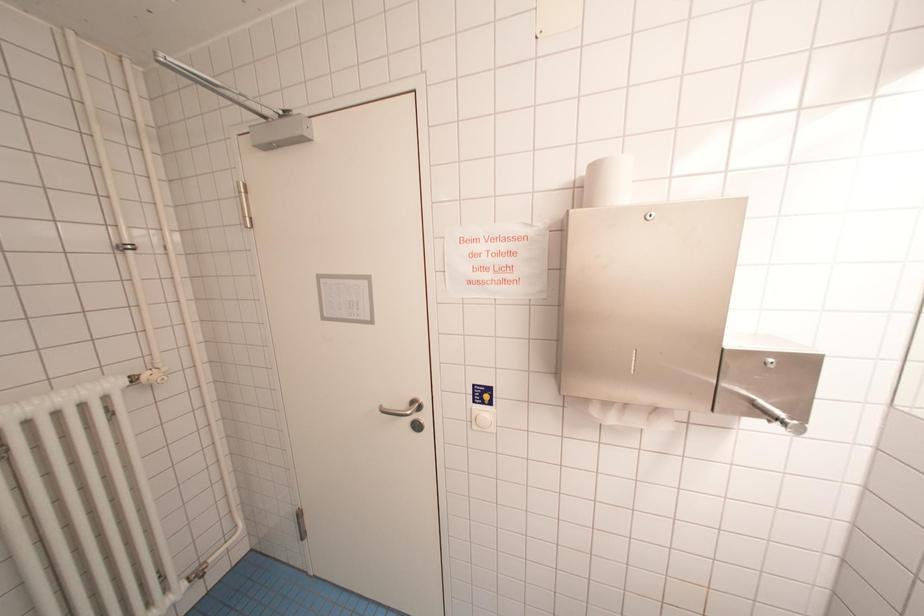
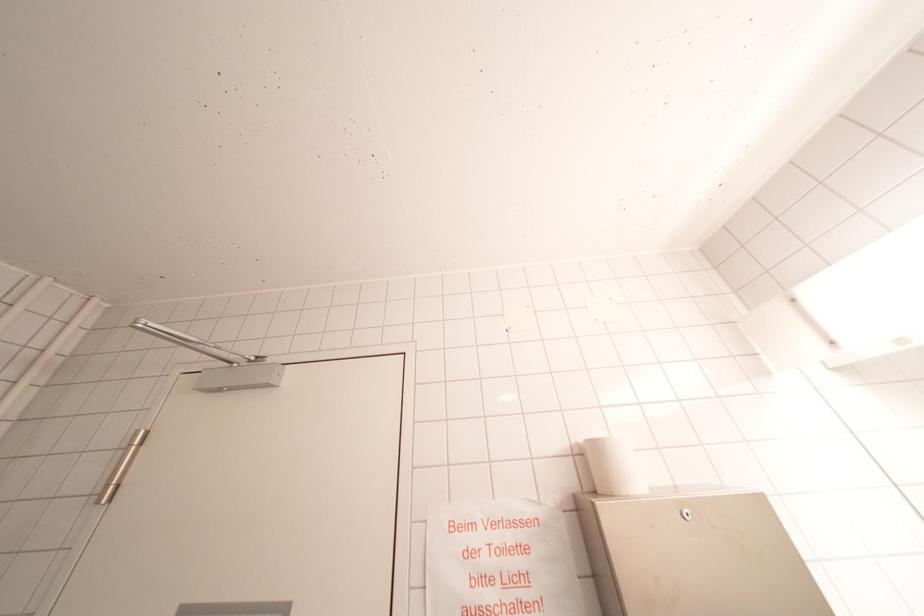
First-person continuous shooting, in which direction is the camera rotating?

The camera's rotation is toward right-up.